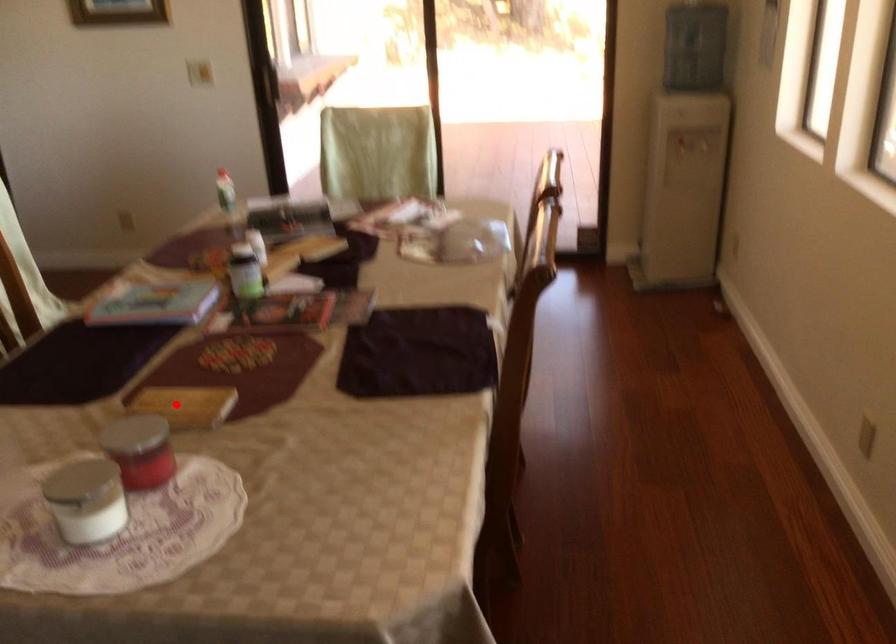
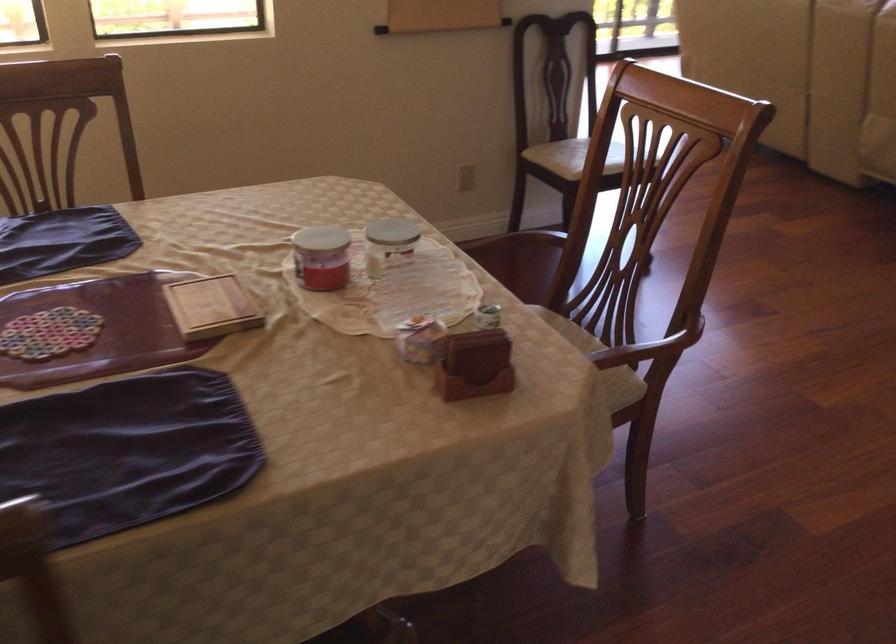
Locate, in the second image, the point that corresponds to the highlighted location in the first image.

(211, 307)